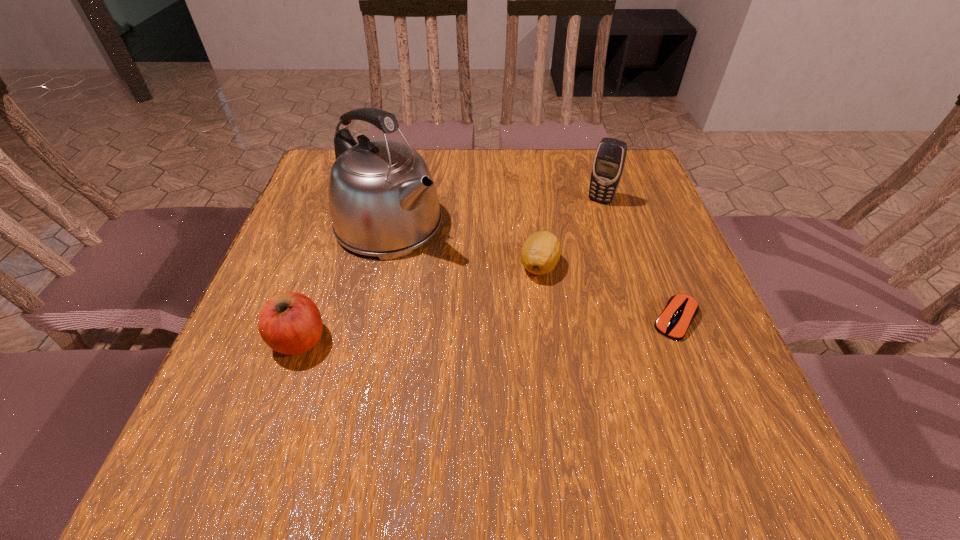
Locate an element on the screen. The width and height of the screenshot is (960, 540). vacant area between the kettle and the fourth shortest object is located at coordinates (494, 212).

The width and height of the screenshot is (960, 540). In order to click on empty space between the fourth shortest object and the apple in this screenshot , I will do `click(450, 270)`.

Where is `free space between the apple and the kettle`? The image size is (960, 540). free space between the apple and the kettle is located at coordinates (345, 281).

Find the location of a particular element. This screenshot has width=960, height=540. unoccupied position between the third tallest object and the lemon is located at coordinates (420, 302).

Locate an element on the screen. Image resolution: width=960 pixels, height=540 pixels. vacant area between the tallest object and the cellular telephone is located at coordinates (494, 212).

Identify the location of vacant space that's between the fourth shortest object and the shortest object. Image resolution: width=960 pixels, height=540 pixels. (638, 260).

Identify the location of free spot between the tallest object and the third shortest object. This screenshot has width=960, height=540. (345, 281).

Find the location of a particular element. free spot between the tallest object and the cellular telephone is located at coordinates (494, 212).

Where is `object that is the third closest to the cellular telephone`? object that is the third closest to the cellular telephone is located at coordinates (383, 202).

You are a GUI agent. You are given a task and a screenshot of the screen. Output one action in this format:
    pyautogui.click(x=<x>, y=<y>)
    Task: Click on the object that is the fourth closest to the computer mouse
    
    Given the screenshot: What is the action you would take?
    coord(290,323)